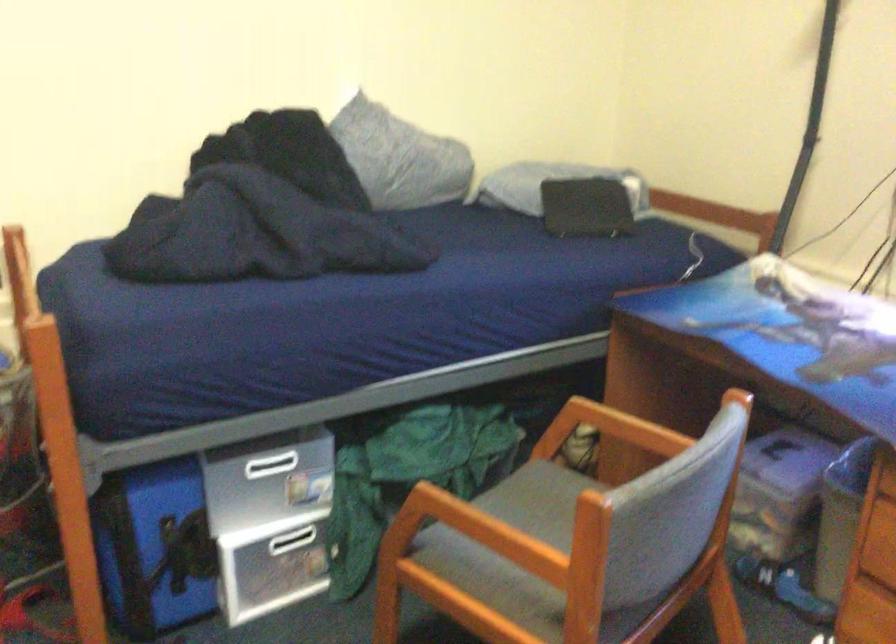
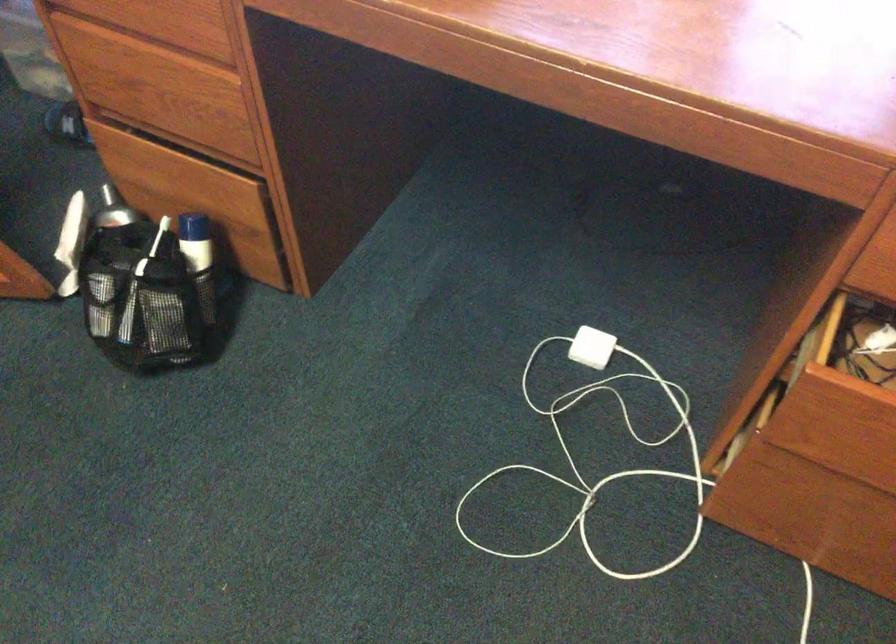
The first image is from the beginning of the video and the second image is from the end. How did the camera likely rotate when shooting the video?

The rotation direction of the camera is right-down.